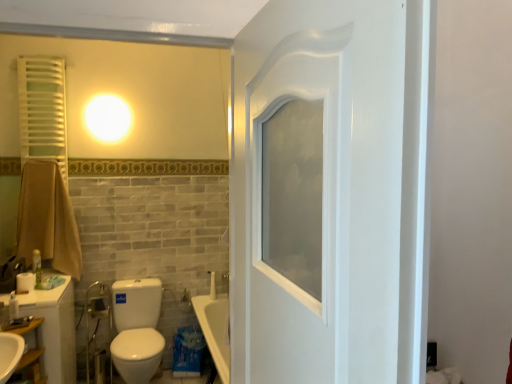
Question: From the image's perspective, is white glossy toilet at lower left over white matte toilet paper at lower left?

Choices:
 (A) yes
 (B) no

Answer: (B)

Question: Is white glossy toilet at lower left turned away from white matte toilet paper at lower left?

Choices:
 (A) yes
 (B) no

Answer: (B)

Question: Considering the relative sizes of white glossy toilet at lower left and white matte toilet paper at lower left in the image provided, is white glossy toilet at lower left shorter than white matte toilet paper at lower left?

Choices:
 (A) no
 (B) yes

Answer: (A)

Question: Can you confirm if white glossy toilet at lower left is wider than white matte toilet paper at lower left?

Choices:
 (A) yes
 (B) no

Answer: (A)

Question: Does white glossy toilet at lower left have a lesser width compared to white matte toilet paper at lower left?

Choices:
 (A) no
 (B) yes

Answer: (A)

Question: Considering the positions of green matte bottle at left and metallic chrome faucet at lower left in the image, is green matte bottle at left wider or thinner than metallic chrome faucet at lower left?

Choices:
 (A) thin
 (B) wide

Answer: (A)

Question: Is green matte bottle at left to the left or to the right of metallic chrome faucet at lower left in the image?

Choices:
 (A) right
 (B) left

Answer: (B)

Question: In the image, is green matte bottle at left positioned in front of or behind metallic chrome faucet at lower left?

Choices:
 (A) front
 (B) behind

Answer: (A)

Question: From their relative heights in the image, would you say green matte bottle at left is taller or shorter than metallic chrome faucet at lower left?

Choices:
 (A) tall
 (B) short

Answer: (B)

Question: Visually, is white glossy toilet at lower left positioned to the left or to the right of brown cotton towel at left?

Choices:
 (A) left
 (B) right

Answer: (B)

Question: Relative to brown cotton towel at left, is white glossy toilet at lower left in front or behind?

Choices:
 (A) behind
 (B) front

Answer: (B)

Question: Considering the positions of white glossy toilet at lower left and brown cotton towel at left in the image, is white glossy toilet at lower left wider or thinner than brown cotton towel at left?

Choices:
 (A) wide
 (B) thin

Answer: (A)

Question: From a real-world perspective, is white glossy toilet at lower left above or below brown cotton towel at left?

Choices:
 (A) below
 (B) above

Answer: (A)

Question: Relative to brown cotton towel at left, is green matte bottle at left in front or behind?

Choices:
 (A) front
 (B) behind

Answer: (A)

Question: In terms of width, does green matte bottle at left look wider or thinner when compared to brown cotton towel at left?

Choices:
 (A) wide
 (B) thin

Answer: (B)